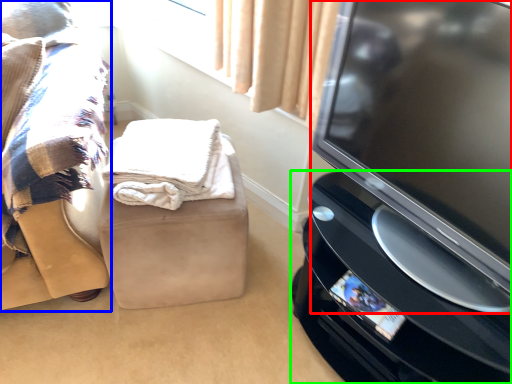
Question: Which is farther away from television (highlighted by a red box)? furniture (highlighted by a blue box) or home appliance (highlighted by a green box)?

Choices:
 (A) furniture
 (B) home appliance

Answer: (A)